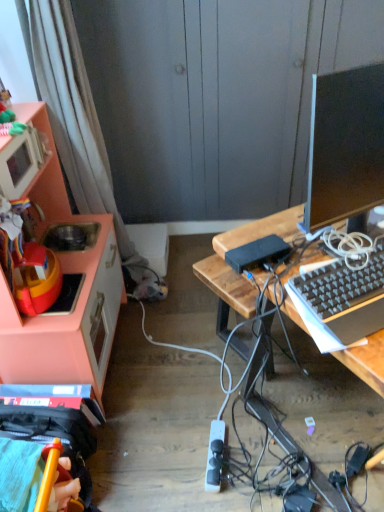
Identify the location of vacant space behind white plastic power outlet at lower center. (202, 413).